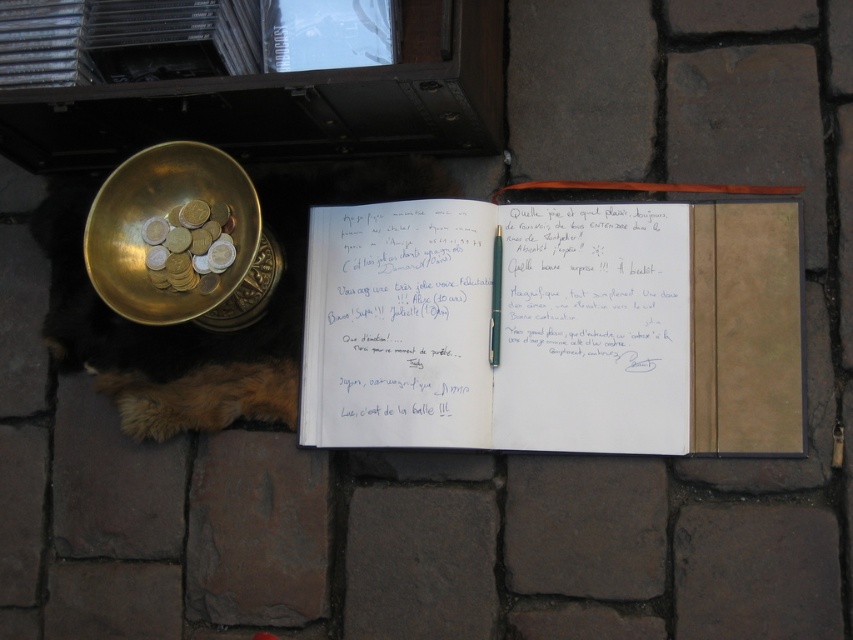
You are a photographer setting up a shot of the brown fur dog at lower left and the gold metallic coins at left. Which object should you focus on first if you want to capture both in the frame without moving the camera?

The brown fur dog at lower left is bigger than the gold metallic coins at left, so you should focus on the brown fur dog at lower left first to ensure it fills the frame appropriately before adjusting for the smaller coins.

From the picture: You are standing at the edge of the cobblestone area and want to reach the gold metallic bowl at upper left without stepping on the brown fur dog at lower left. Which direction should you move first?

The brown fur dog at lower left is to the right of the gold metallic bowl at upper left, so you should move to the left first to avoid stepping on the dog.

You are a tourist who just arrived at this cobblestone area and see the gold metallic bowl at upper left and the gold metallic coins at left. Which object is positioned more to the right side?

The gold metallic bowl at upper left is positioned to the right of the gold metallic coins at left.